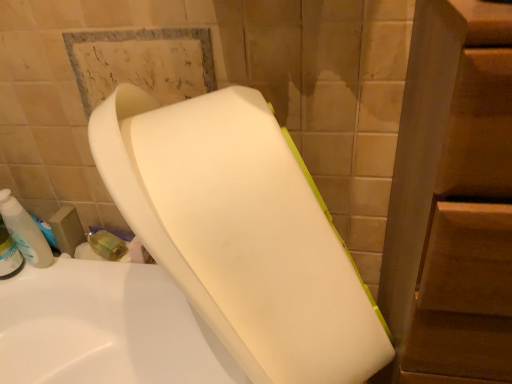
The height and width of the screenshot is (384, 512). What do you see at coordinates (198, 262) in the screenshot?
I see `white matte toilet at center` at bounding box center [198, 262].

The height and width of the screenshot is (384, 512). Find the location of `white matte toilet at center`. white matte toilet at center is located at coordinates (198, 262).

What do you see at coordinates (25, 231) in the screenshot? I see `translucent plastic soap dispenser at left` at bounding box center [25, 231].

You are a GUI agent. You are given a task and a screenshot of the screen. Output one action in this format:
    pyautogui.click(x=<x>, y=<y>)
    Task: Click on the translucent plastic soap dispenser at left
    The image size is (512, 384).
    Given the screenshot: What is the action you would take?
    pyautogui.click(x=25, y=231)

This screenshot has width=512, height=384. In order to click on white matte toilet at center in this screenshot , I will do `click(198, 262)`.

Can you confirm if white matte toilet at center is positioned to the right of translucent plastic soap dispenser at left?

Indeed, white matte toilet at center is positioned on the right side of translucent plastic soap dispenser at left.

Does white matte toilet at center lie behind translucent plastic soap dispenser at left?

No, it is in front of translucent plastic soap dispenser at left.

Does point (282, 249) come in front of point (20, 220)?

Yes, point (282, 249) is in front of point (20, 220).

From the image's perspective, is white matte toilet at center above translucent plastic soap dispenser at left?

No, from the image's perspective, white matte toilet at center is not on top of translucent plastic soap dispenser at left.

From a real-world perspective, which is physically below, white matte toilet at center or translucent plastic soap dispenser at left?

A: In real-world perspective, translucent plastic soap dispenser at left is lower.

Is white matte toilet at center thinner than translucent plastic soap dispenser at left?

No.

Can you confirm if white matte toilet at center is shorter than translucent plastic soap dispenser at left?

No.

Considering the relative sizes of white matte toilet at center and translucent plastic soap dispenser at left in the image provided, is white matte toilet at center smaller than translucent plastic soap dispenser at left?

No.

Is translucent plastic soap dispenser at left inside white matte toilet at center?

That's incorrect, translucent plastic soap dispenser at left is not inside white matte toilet at center.

Are white matte toilet at center and translucent plastic soap dispenser at left far apart?

white matte toilet at center is near translucent plastic soap dispenser at left, not far away.

Is white matte toilet at center positioned with its back to translucent plastic soap dispenser at left?

No, white matte toilet at center is not facing the opposite direction of translucent plastic soap dispenser at left.

How many degrees apart are the facing directions of white matte toilet at center and translucent plastic soap dispenser at left?

The facing directions of white matte toilet at center and translucent plastic soap dispenser at left are 13.4 degrees apart.

Image resolution: width=512 pixels, height=384 pixels. I want to click on cleaning product behind the white matte toilet at center, so click(25, 231).

Which object is positioned more to the left, translucent plastic soap dispenser at left or white matte toilet at center?

translucent plastic soap dispenser at left.

Which object is further away from the camera, translucent plastic soap dispenser at left or white matte toilet at center?

Positioned behind is translucent plastic soap dispenser at left.

Does point (4, 214) come closer to viewer compared to point (121, 346)?

That is True.

From the image's perspective, is translucent plastic soap dispenser at left beneath white matte toilet at center?

Incorrect, from the image's perspective, translucent plastic soap dispenser at left is higher than white matte toilet at center.

From a real-world perspective, relative to white matte toilet at center, is translucent plastic soap dispenser at left vertically above or below?

translucent plastic soap dispenser at left is situated lower than white matte toilet at center in the real world.

Considering the sizes of translucent plastic soap dispenser at left and white matte toilet at center in the image, is translucent plastic soap dispenser at left wider or thinner than white matte toilet at center?

Clearly, translucent plastic soap dispenser at left has less width compared to white matte toilet at center.

In terms of height, does translucent plastic soap dispenser at left look taller or shorter compared to white matte toilet at center?

translucent plastic soap dispenser at left is shorter than white matte toilet at center.

Which of these two, translucent plastic soap dispenser at left or white matte toilet at center, is smaller?

translucent plastic soap dispenser at left.

Is translucent plastic soap dispenser at left located outside white matte toilet at center?

Indeed, translucent plastic soap dispenser at left is completely outside white matte toilet at center.

Is the surface of translucent plastic soap dispenser at left in direct contact with white matte toilet at center?

No, translucent plastic soap dispenser at left is not beside white matte toilet at center.

Is white matte toilet at center at the back of translucent plastic soap dispenser at left?

No.

At what (x,y) coordinates should I click in order to perform the action: click on toilet lying on the right of translucent plastic soap dispenser at left. Please return your answer as a coordinate pair (x, y). Looking at the image, I should click on (198, 262).

Locate an element on the screen. The height and width of the screenshot is (384, 512). toilet above the translucent plastic soap dispenser at left (from a real-world perspective) is located at coordinates (198, 262).

Image resolution: width=512 pixels, height=384 pixels. I want to click on toilet below the translucent plastic soap dispenser at left (from the image's perspective), so click(198, 262).